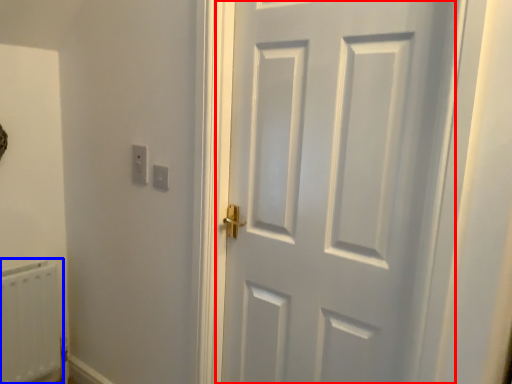
Question: Which object appears farthest to the camera in this image, door (highlighted by a red box) or radiator (highlighted by a blue box)?

Choices:
 (A) door
 (B) radiator

Answer: (B)